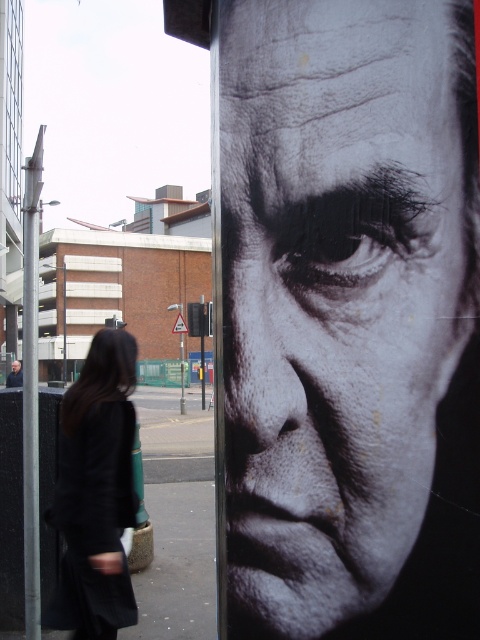
Question: Which point is farther to the camera?

Choices:
 (A) (88, 476)
 (B) (467, 44)

Answer: (A)

Question: Does black fabric coat at lower left have a lesser width compared to smooth skin face at center?

Choices:
 (A) no
 (B) yes

Answer: (B)

Question: Which object appears farthest from the camera in this image?

Choices:
 (A) black fabric coat at lower left
 (B) black matte face at center

Answer: (A)

Question: Which point appears closest to the camera in this image?

Choices:
 (A) (74, 477)
 (B) (466, 125)

Answer: (B)

Question: Does black matte face at center appear over black fabric coat at lower left?

Choices:
 (A) no
 (B) yes

Answer: (B)

Question: Does black matte face at center appear on the left side of black fabric coat at lower left?

Choices:
 (A) yes
 (B) no

Answer: (B)